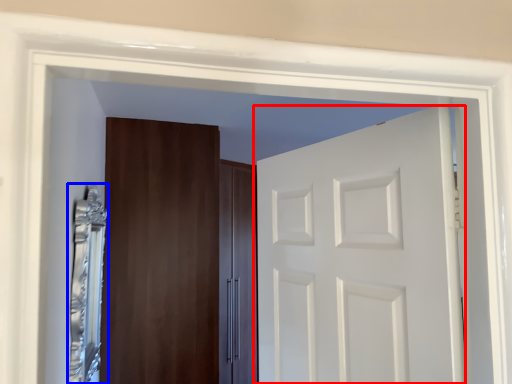
Question: Among these objects, which one is farthest to the camera, door (highlighted by a red box) or mirror (highlighted by a blue box)?

Choices:
 (A) door
 (B) mirror

Answer: (B)